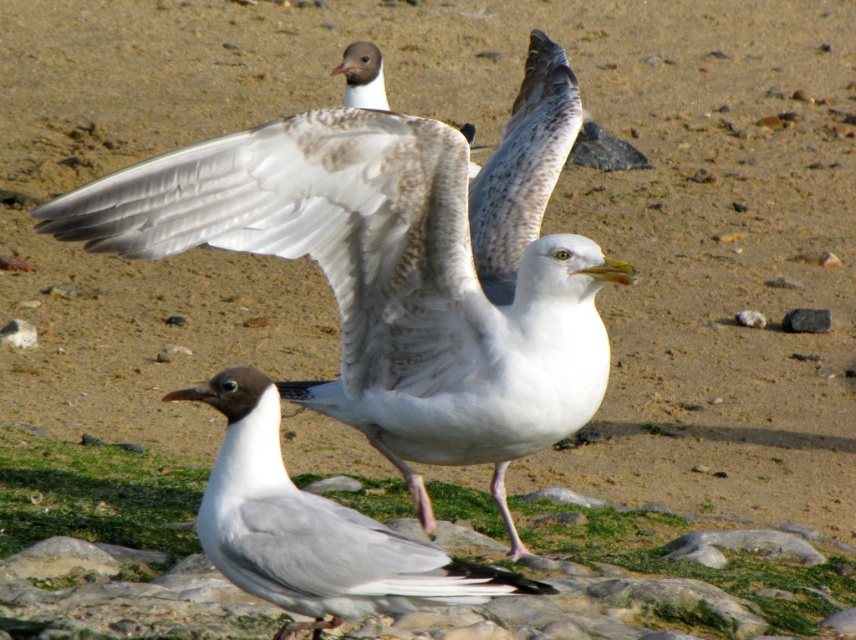
Does white feathered bird at center appear over gray matte seagull at center?

Correct, white feathered bird at center is located above gray matte seagull at center.

Between point (218, 209) and point (331, 564), which one is positioned in front?

Point (331, 564)

Locate an element on the screen. This screenshot has height=640, width=856. white feathered bird at center is located at coordinates (400, 266).

Identify the location of white feathered bird at center. The width and height of the screenshot is (856, 640). (400, 266).